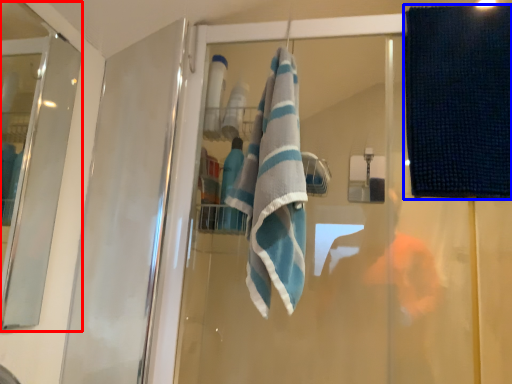
Question: Which object is further to the camera taking this photo, screen door (highlighted by a red box) or beach towel (highlighted by a blue box)?

Choices:
 (A) screen door
 (B) beach towel

Answer: (B)